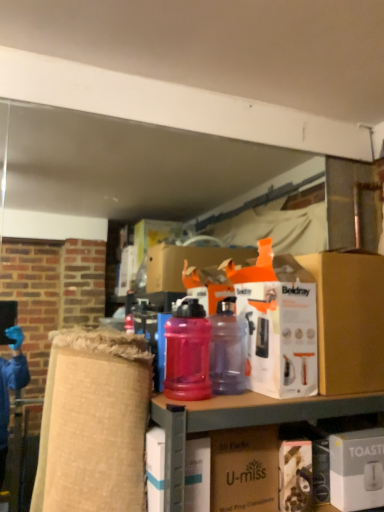
Question: Could you tell me if white matte toaster at lower right, the third box positioned from the left, is turned towards orange cardboard box at center, the 2th box when ordered from right to left?

Choices:
 (A) yes
 (B) no

Answer: (B)

Question: Can you confirm if white matte toaster at lower right, the third box positioned from the left, is positioned to the left of orange cardboard box at center, the second box viewed from the left?

Choices:
 (A) no
 (B) yes

Answer: (A)

Question: From a real-world perspective, is white matte toaster at lower right, which is the first box from right to left, physically below orange cardboard box at center, the second box viewed from the left?

Choices:
 (A) yes
 (B) no

Answer: (A)

Question: Considering the relative sizes of white matte toaster at lower right, which is the first box from right to left, and orange cardboard box at center, the 2th box when ordered from right to left, in the image provided, is white matte toaster at lower right, which is the first box from right to left, smaller than orange cardboard box at center, the 2th box when ordered from right to left,?

Choices:
 (A) yes
 (B) no

Answer: (A)

Question: Is white matte toaster at lower right, the third box positioned from the left, to the right of orange cardboard box at center, the 2th box when ordered from right to left, from the viewer's perspective?

Choices:
 (A) yes
 (B) no

Answer: (A)

Question: Considering the positions of point (188, 401) and point (208, 478), is point (188, 401) closer or farther from the camera than point (208, 478)?

Choices:
 (A) farther
 (B) closer

Answer: (B)

Question: Is translucent plastic bottles at center bigger or smaller than white cardboard box at center, arranged as the 3th box when viewed from the right?

Choices:
 (A) big
 (B) small

Answer: (A)

Question: Considering the relative positions of translucent plastic bottles at center and white cardboard box at center, which is the first box from left to right, in the image provided, is translucent plastic bottles at center to the left or to the right of white cardboard box at center, which is the first box from left to right,?

Choices:
 (A) right
 (B) left

Answer: (A)

Question: In terms of width, does translucent plastic bottles at center look wider or thinner when compared to white cardboard box at center, which is the first box from left to right?

Choices:
 (A) wide
 (B) thin

Answer: (A)

Question: Is orange cardboard box at center, the second box viewed from the left, taller or shorter than matte brown cardboard box at center?

Choices:
 (A) short
 (B) tall

Answer: (B)

Question: Considering the positions of point (350, 304) and point (248, 441), is point (350, 304) closer or farther from the camera than point (248, 441)?

Choices:
 (A) farther
 (B) closer

Answer: (A)

Question: Would you say orange cardboard box at center, the 2th box when ordered from right to left, is inside or outside matte brown cardboard box at center?

Choices:
 (A) outside
 (B) inside

Answer: (A)

Question: From the image's perspective, is orange cardboard box at center, the 2th box when ordered from right to left, positioned above or below matte brown cardboard box at center?

Choices:
 (A) below
 (B) above

Answer: (B)

Question: Considering the relative positions of translucent plastic water bottle at center, arranged as the 1th bottle when viewed from the left, and white cardboard box at center, which is the first box from left to right, in the image provided, is translucent plastic water bottle at center, arranged as the 1th bottle when viewed from the left, to the left or to the right of white cardboard box at center, which is the first box from left to right,?

Choices:
 (A) left
 (B) right

Answer: (B)

Question: Is point (190, 362) closer or farther from the camera than point (203, 484)?

Choices:
 (A) farther
 (B) closer

Answer: (A)